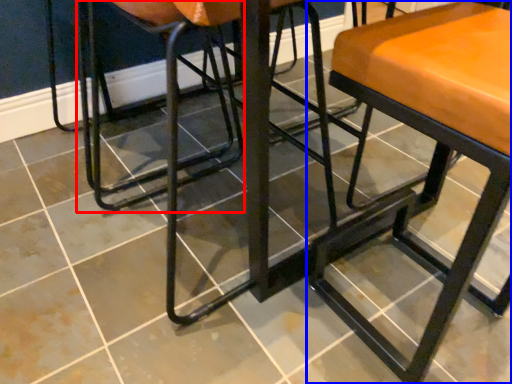
Question: Among these objects, which one is farthest to the camera, swivel chair (highlighted by a red box) or stool (highlighted by a blue box)?

Choices:
 (A) swivel chair
 (B) stool

Answer: (A)